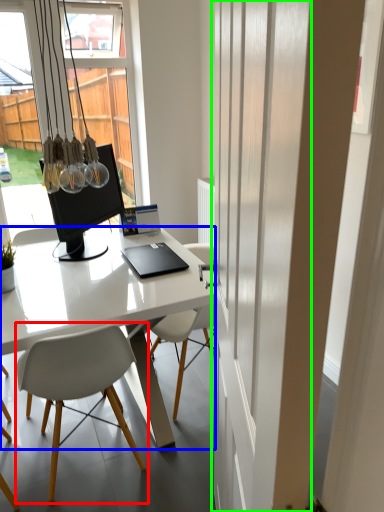
Question: Which object is the farthest from chair (highlighted by a red box)? Choose among these: desk (highlighted by a blue box) or screen door (highlighted by a green box).

Choices:
 (A) desk
 (B) screen door

Answer: (B)